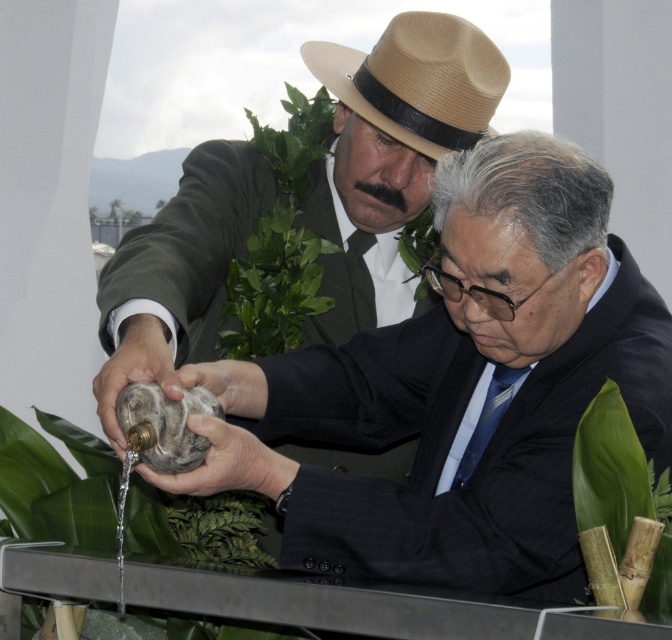
Question: Is matte black suit at center below tan straw fedora at upper center?

Choices:
 (A) no
 (B) yes

Answer: (B)

Question: Among these points, which one is nearest to the camera?

Choices:
 (A) (462, 81)
 (B) (480, 417)
 (C) (261, 236)

Answer: (B)

Question: Considering the relative positions of green leafy plant at upper center and green bamboo at lower right in the image provided, where is green leafy plant at upper center located with respect to green bamboo at lower right?

Choices:
 (A) below
 (B) above

Answer: (B)

Question: Which object is the closest to the green bamboo at lower right?

Choices:
 (A) green leafy plant at upper center
 (B) blue silk tie at center

Answer: (B)

Question: Which point is closer to the camera taking this photo?

Choices:
 (A) (489, 438)
 (B) (376, 369)

Answer: (A)

Question: Does green leafy plant at upper center have a greater width compared to blue silk tie at center?

Choices:
 (A) no
 (B) yes

Answer: (B)